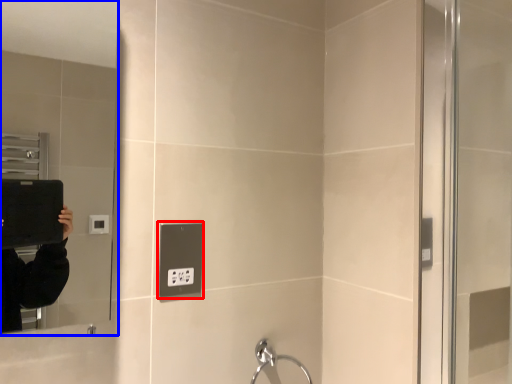
Question: Among these objects, which one is farthest to the camera, electric outlet (highlighted by a red box) or mirror (highlighted by a blue box)?

Choices:
 (A) electric outlet
 (B) mirror

Answer: (A)